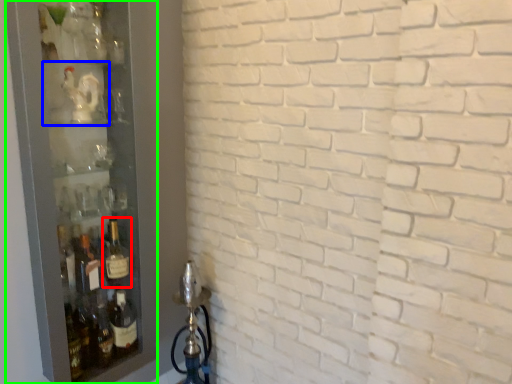
Question: Which object is positioned farthest from bottle (highlighted by a red box)? Select from shelf (highlighted by a blue box) and glass door (highlighted by a green box).

Choices:
 (A) shelf
 (B) glass door

Answer: (A)